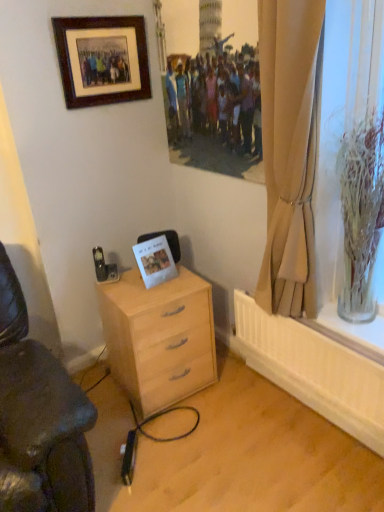
Question: From a real-world perspective, is clear glass vase at right beneath wooden picture frame at upper left?

Choices:
 (A) no
 (B) yes

Answer: (B)

Question: Considering the relative sizes of clear glass vase at right and wooden picture frame at upper left in the image provided, is clear glass vase at right wider than wooden picture frame at upper left?

Choices:
 (A) yes
 (B) no

Answer: (A)

Question: Is wooden picture frame at upper left a part of clear glass vase at right?

Choices:
 (A) no
 (B) yes

Answer: (A)

Question: Does clear glass vase at right appear on the right side of wooden picture frame at upper left?

Choices:
 (A) no
 (B) yes

Answer: (B)

Question: Is clear glass vase at right facing towards wooden picture frame at upper left?

Choices:
 (A) no
 (B) yes

Answer: (A)

Question: From a real-world perspective, is clear glass vase at right positioned over wooden picture frame at upper left based on gravity?

Choices:
 (A) yes
 (B) no

Answer: (B)

Question: Is wooden picture frame at upper left completely or partially inside white paper postcard at center?

Choices:
 (A) yes
 (B) no

Answer: (B)

Question: Does white paper postcard at center appear on the right side of wooden picture frame at upper left?

Choices:
 (A) yes
 (B) no

Answer: (A)

Question: From a real-world perspective, does white paper postcard at center stand above wooden picture frame at upper left?

Choices:
 (A) no
 (B) yes

Answer: (A)

Question: Is white paper postcard at center not inside wooden picture frame at upper left?

Choices:
 (A) yes
 (B) no

Answer: (A)

Question: From the image's perspective, is white paper postcard at center located beneath wooden picture frame at upper left?

Choices:
 (A) no
 (B) yes

Answer: (B)

Question: Considering the relative sizes of white paper postcard at center and wooden picture frame at upper left in the image provided, is white paper postcard at center taller than wooden picture frame at upper left?

Choices:
 (A) yes
 (B) no

Answer: (B)

Question: Is beige fabric curtain at right in front of white paper postcard at center?

Choices:
 (A) yes
 (B) no

Answer: (A)